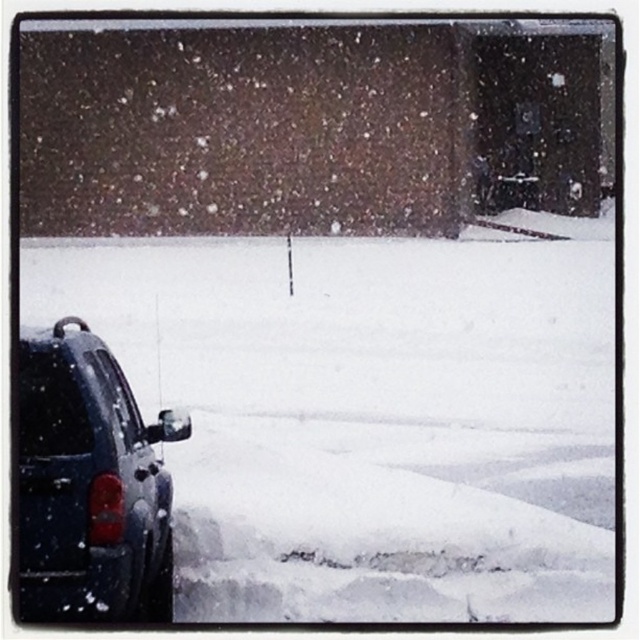
You are standing at the center of the snowy area and want to reach the white fluffy snow at lower left. Which direction should you move to reach it?

You should move to the lower left direction to reach the white fluffy snow at lower left.